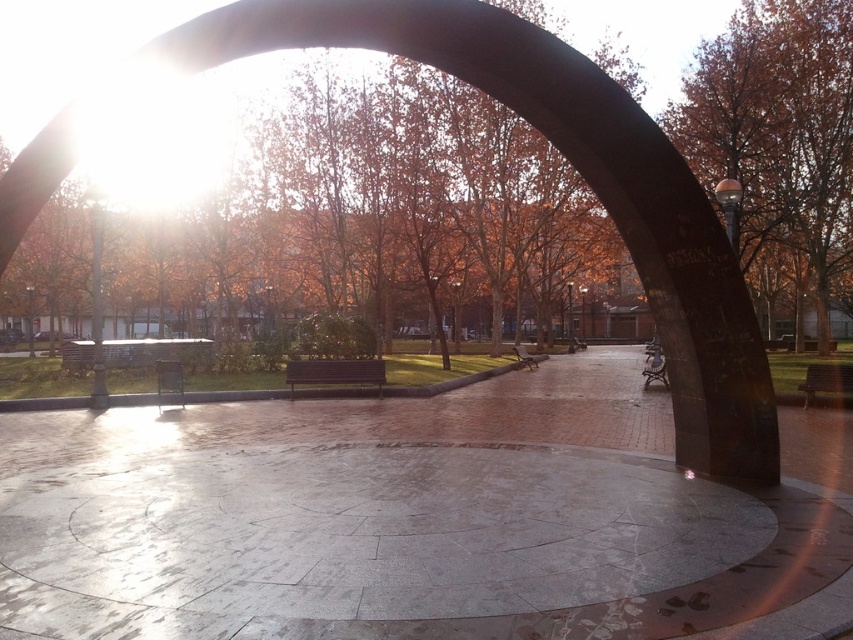
You are standing in the park and want to reach the point at coordinates point (56, 129). If you walk straight ahead, will you arrive at that point without needing to turn?

The point (56, 129) is 6.29 meters away from the viewer. Since the park has a clear path forward with no obstacles mentioned, walking straight should lead you to the point without needing to turn.

You are standing in the park and want to take a photo of the polished bronze arch at center and the brown wood tree at right. Which object will appear closer to the bottom of your photo?

The polished bronze arch at center will appear closer to the bottom of your photo because it is positioned below the brown wood tree at right.

You are planning to take a photo of the park scene. You want to ensure both the polished bronze arch at center and the brown wood tree at right are fully visible in the frame. Given their sizes, which object might require you to adjust your camera angle to fit into the composition?

The brown wood tree at right occupies more space than the polished bronze arch at center, so you might need to adjust your camera angle to include the entire tree in the frame.